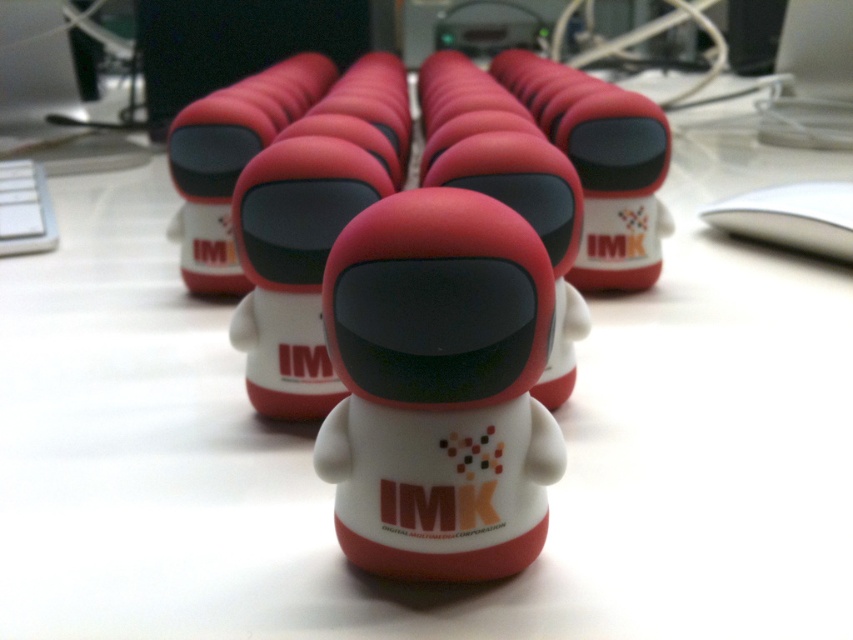
Question: Among these points, which one is farthest from the camera?

Choices:
 (A) (515, 163)
 (B) (392, 200)
 (C) (236, 268)

Answer: (C)

Question: Can you confirm if matte plastic toy at center is positioned to the right of matte white toy at center?

Choices:
 (A) yes
 (B) no

Answer: (A)

Question: Does matte plastic toy at center have a larger size compared to white matte robot at center?

Choices:
 (A) no
 (B) yes

Answer: (B)

Question: Which point is farther from the camera taking this photo?

Choices:
 (A) (457, 380)
 (B) (448, 164)

Answer: (B)

Question: Which point appears farthest from the camera in this image?

Choices:
 (A) (440, 266)
 (B) (641, 182)

Answer: (B)

Question: Can you confirm if matte plastic toy at center is wider than white matte robot at center?

Choices:
 (A) yes
 (B) no

Answer: (A)